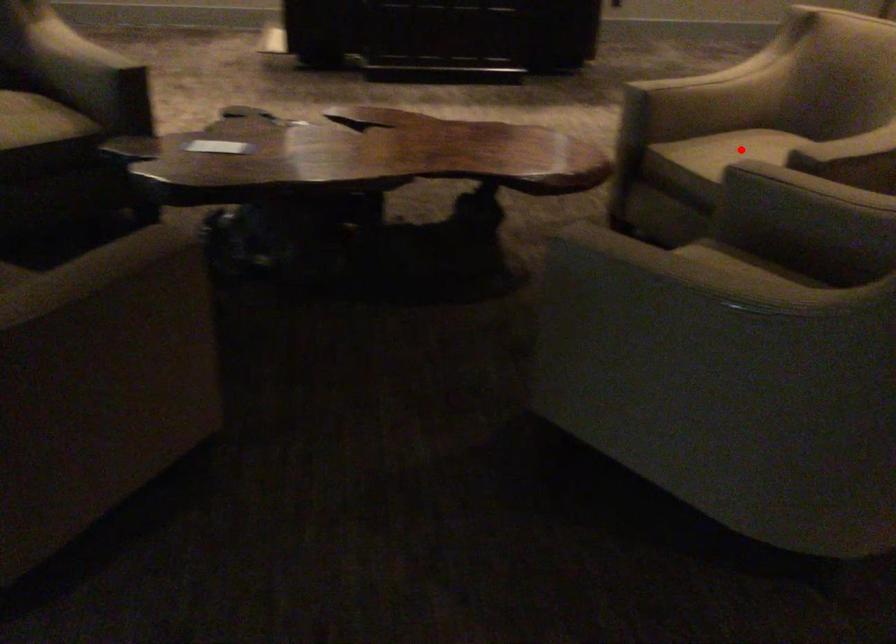
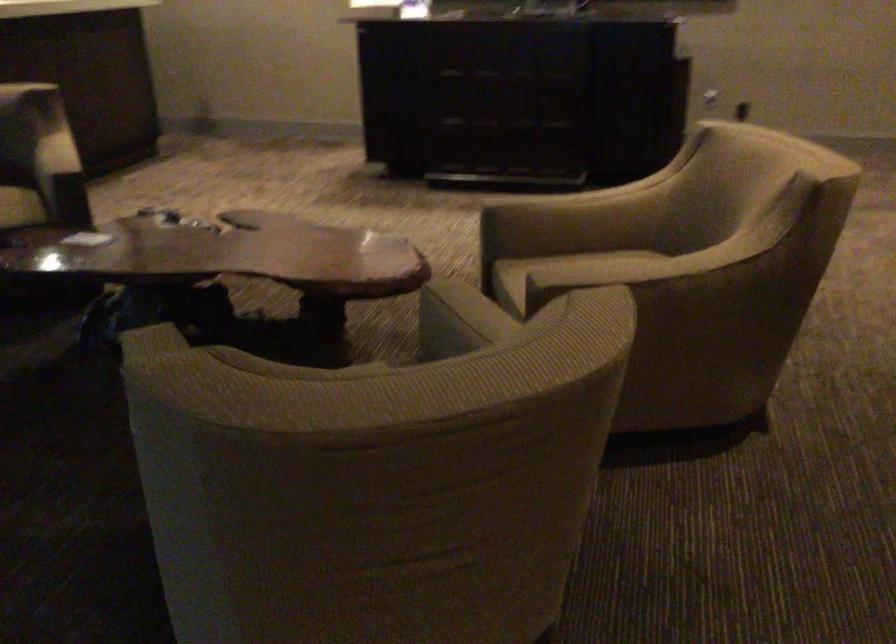
Question: I am providing you with two images of the same scene from different viewpoints. A red point is marked on the first image. Can you still see the location of the red point in image 2?

Choices:
 (A) Yes
 (B) No

Answer: (B)